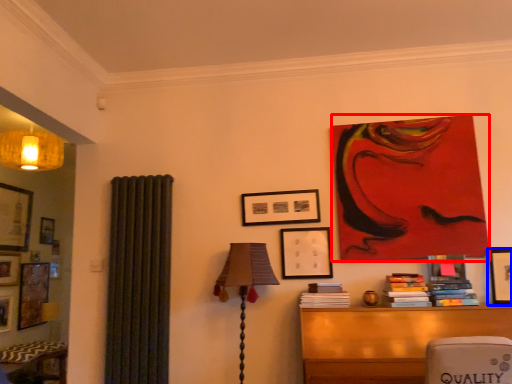
Question: Which object is closer to the camera taking this photo, art (highlighted by a red box) or picture frame (highlighted by a blue box)?

Choices:
 (A) art
 (B) picture frame

Answer: (B)